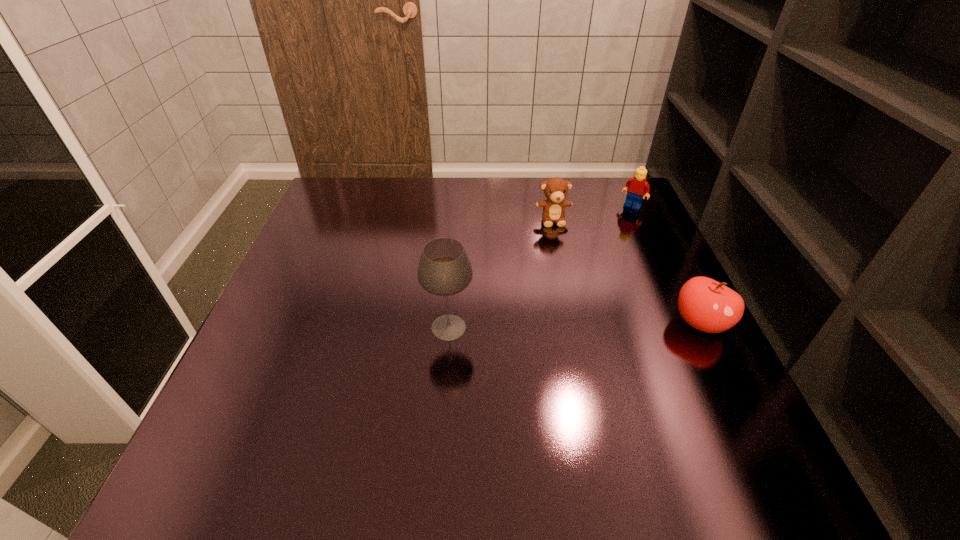
Identify the location of unoccupied position between the teddy bear and the farthest object. This screenshot has height=540, width=960. (592, 213).

In order to click on free space between the apple and the farthest object in this screenshot , I will do `click(666, 265)`.

This screenshot has height=540, width=960. Identify the location of free area in between the apple and the Lego. (666, 265).

This screenshot has width=960, height=540. I want to click on free area in between the apple and the Lego, so click(x=666, y=265).

The image size is (960, 540). I want to click on free space between the leftmost object and the Lego, so click(x=540, y=267).

Where is `blank region between the Lego and the leftmost object`? The width and height of the screenshot is (960, 540). blank region between the Lego and the leftmost object is located at coordinates (540, 267).

The width and height of the screenshot is (960, 540). In order to click on object that can be found as the second closest to the third nearest object in this screenshot , I will do `click(706, 304)`.

Point out which object is positioned as the second nearest to the teddy bear. Please provide its 2D coordinates. Your answer should be formatted as a tuple, i.e. [(x, y)], where the tuple contains the x and y coordinates of a point satisfying the conditions above.

[(706, 304)]

Find the location of a particular element. The width and height of the screenshot is (960, 540). free region that satisfies the following two spatial constraints: 1. on the front side of the apple; 2. on the left side of the Lego is located at coordinates (687, 323).

Image resolution: width=960 pixels, height=540 pixels. Identify the location of blank space that satisfies the following two spatial constraints: 1. on the back side of the wineglass; 2. on the right side of the apple. (449, 323).